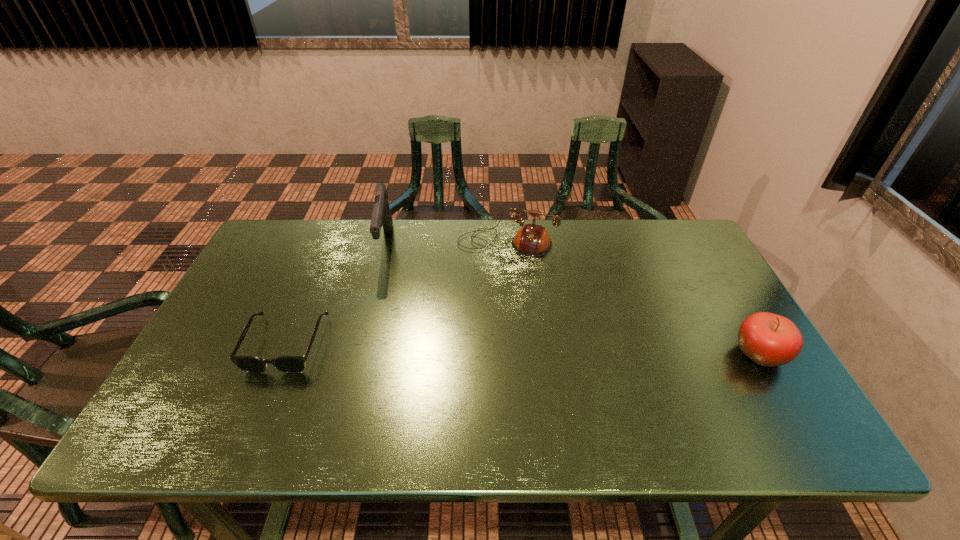
This screenshot has width=960, height=540. In order to click on vacant area that satisfies the following two spatial constraints: 1. at the front lenses of the shortest object; 2. on the left side of the apple in this screenshot , I will do `click(282, 354)`.

I want to click on vacant region that satisfies the following two spatial constraints: 1. at the front lenses of the rightmost object; 2. on the left side of the sunglasses, so click(282, 354).